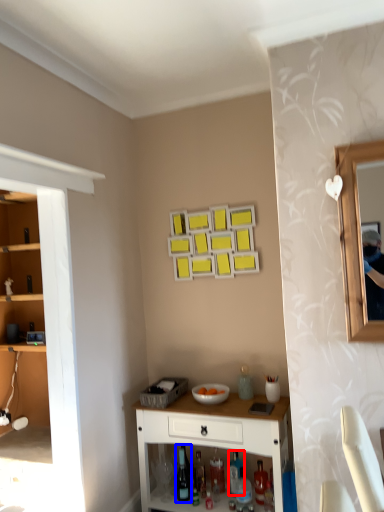
Question: Which point is closer to the camera, bottle (highlighted by a red box) or wine bottle (highlighted by a blue box)?

Choices:
 (A) bottle
 (B) wine bottle

Answer: (B)